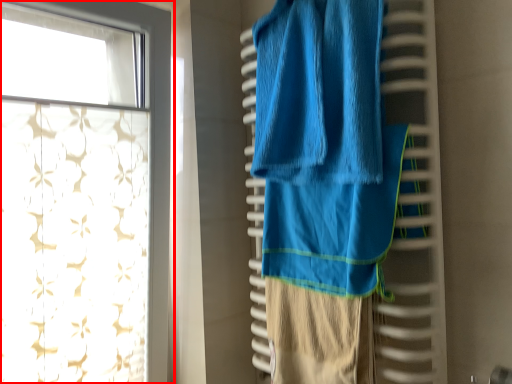
Question: Observing the image, what is the correct spatial positioning of curtain (annotated by the red box) in reference to towel?

Choices:
 (A) left
 (B) right

Answer: (A)